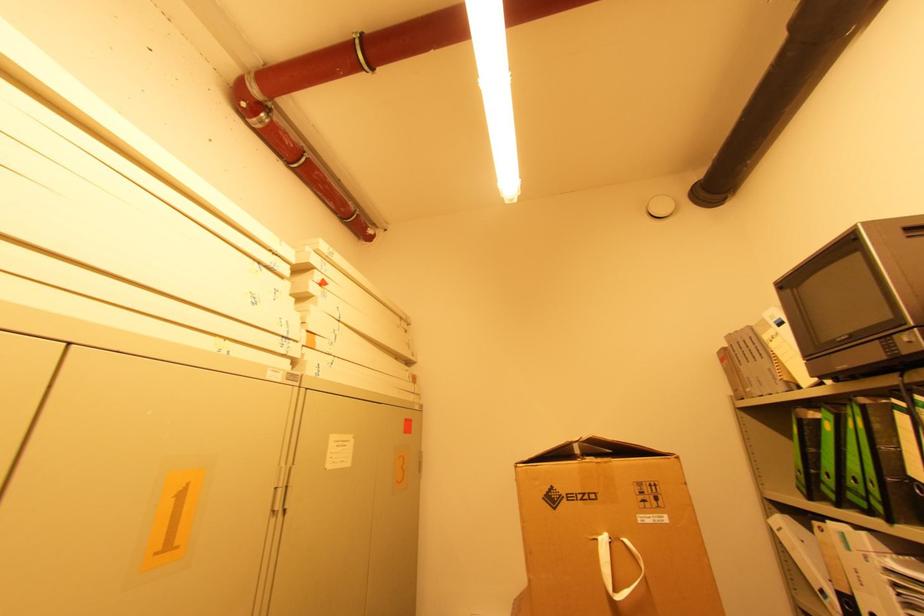
This screenshot has width=924, height=616. What do you see at coordinates (278, 501) in the screenshot?
I see `the metal cabinet handle` at bounding box center [278, 501].